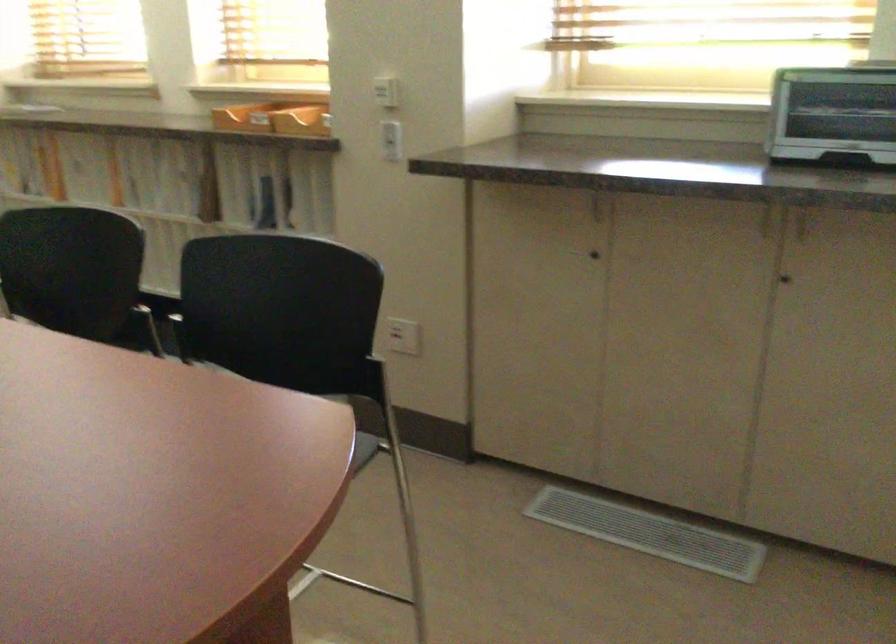
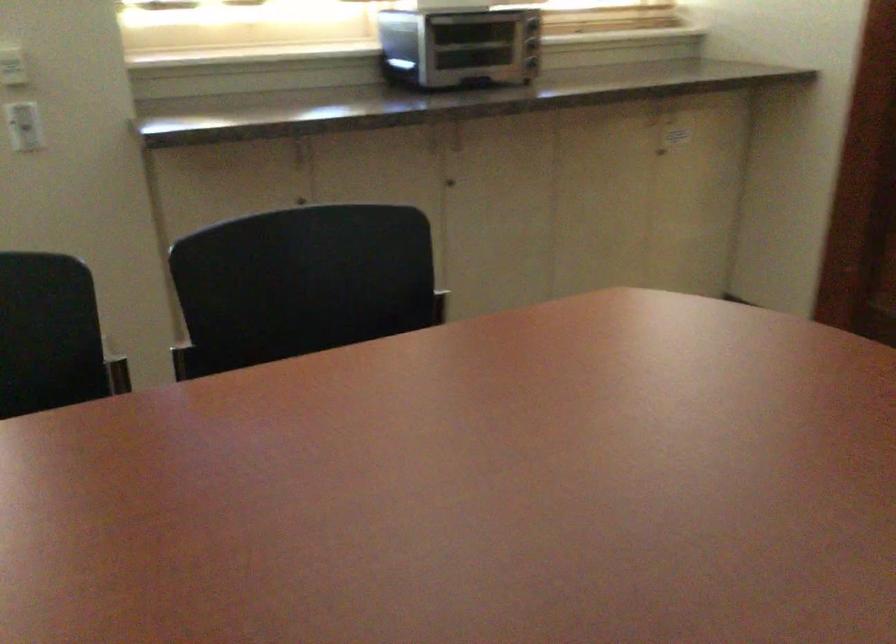
The point at (383,136) is marked in the first image. Where is the corresponding point in the second image?

(24, 126)